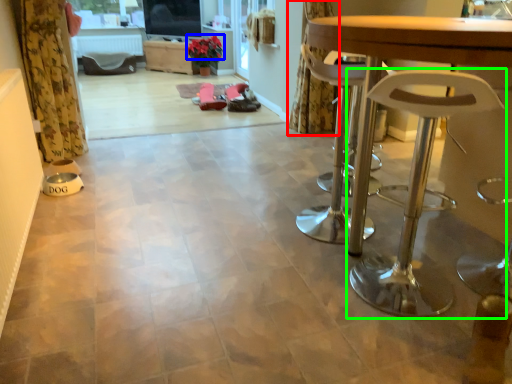
Question: Considering the real-world distances, which object is closest to curtain (highlighted by a red box)? flower (highlighted by a blue box) or stool (highlighted by a green box).

Choices:
 (A) flower
 (B) stool

Answer: (B)